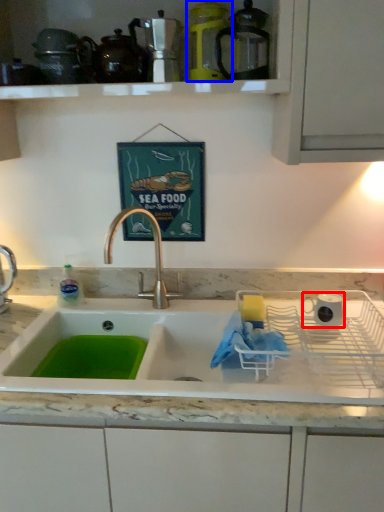
Question: Which object is further to the camera taking this photo, appliance (highlighted by a red box) or appliance (highlighted by a blue box)?

Choices:
 (A) appliance
 (B) appliance

Answer: (A)